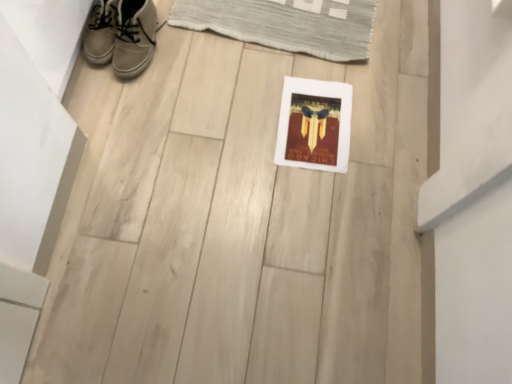
Find the location of a particular element. Image resolution: width=512 pixels, height=384 pixels. vacant space in between leather sneaker at upper left, the 2th footwear in the right-to-left sequence, and white matte picture frame at center is located at coordinates (217, 81).